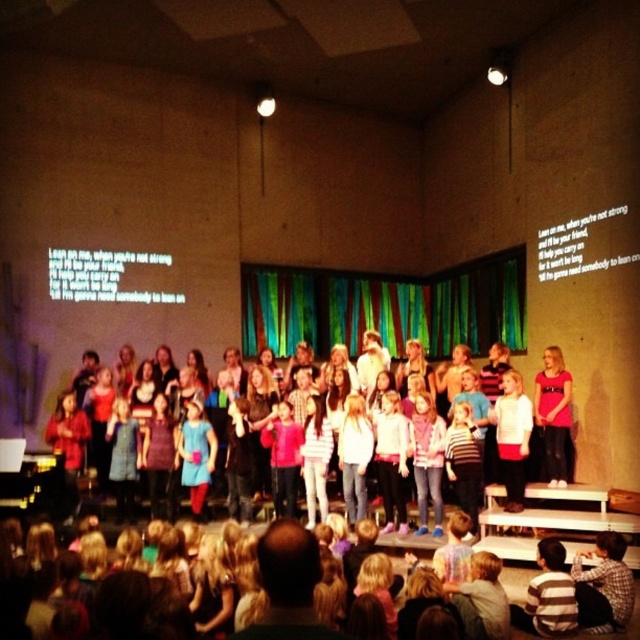
Question: Among these points, which one is nearest to the camera?

Choices:
 (A) coord(572,468)
 (B) coord(289,508)

Answer: (B)

Question: Which point is closer to the camera taking this photo?

Choices:
 (A) (548, 413)
 (B) (266, 422)

Answer: (A)

Question: Can you confirm if matte pink shirt at center is positioned below pink matte shirt at center?

Choices:
 (A) no
 (B) yes

Answer: (A)

Question: Does matte pink shirt at center have a lesser width compared to pink matte shirt at center?

Choices:
 (A) no
 (B) yes

Answer: (A)

Question: Is matte pink shirt at center below pink matte shirt at center?

Choices:
 (A) yes
 (B) no

Answer: (B)

Question: Which of the following is the farthest from the observer?

Choices:
 (A) matte pink shirt at center
 (B) pink matte shirt at center

Answer: (B)